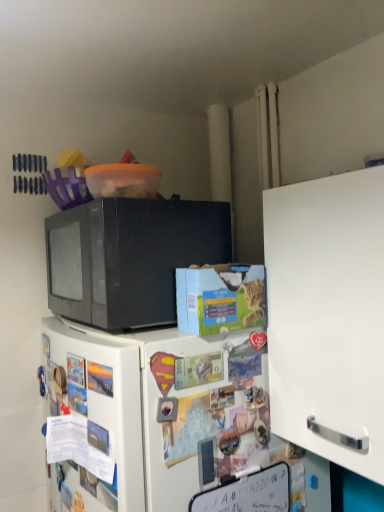
Describe the element at coordinates (130, 257) in the screenshot. The image size is (384, 512). I see `black matte microwave at upper left` at that location.

I want to click on white matte refrigerator at center, so click(x=164, y=422).

Locate an element on the screen. This screenshot has width=384, height=512. white matte cabinet at right is located at coordinates (328, 317).

In terms of width, does white matte refrigerator at center look wider or thinner when compared to black matte microwave at upper left?

In the image, white matte refrigerator at center appears to be wider than black matte microwave at upper left.

From the picture: Can you confirm if white matte refrigerator at center is smaller than black matte microwave at upper left?

No, white matte refrigerator at center is not smaller than black matte microwave at upper left.

Is white matte refrigerator at center surrounding black matte microwave at upper left?

No.

How far apart are white matte refrigerator at center and white matte cabinet at right?

The distance of white matte refrigerator at center from white matte cabinet at right is 10.03 inches.

Is point (153, 425) positioned after point (274, 207)?

No, (153, 425) is in front of (274, 207).

In the scene shown: Considering the relative positions of white matte refrigerator at center and white matte cabinet at right in the image provided, is white matte refrigerator at center to the right of white matte cabinet at right from the viewer's perspective?

No.

Based on their sizes in the image, would you say white matte refrigerator at center is bigger or smaller than white matte cabinet at right?

Considering their sizes, white matte refrigerator at center takes up more space than white matte cabinet at right.

Is white matte cabinet at right positioned with its back to white matte refrigerator at center?

No, white matte cabinet at right is not facing away from white matte refrigerator at center.

Measure the distance between white matte cabinet at right and white matte refrigerator at center.

white matte cabinet at right is 10.03 inches from white matte refrigerator at center.

Considering the relative sizes of white matte cabinet at right and white matte refrigerator at center in the image provided, is white matte cabinet at right bigger than white matte refrigerator at center?

No.

Is white matte cabinet at right inside the boundaries of white matte refrigerator at center, or outside?

white matte cabinet at right cannot be found inside white matte refrigerator at center.

From a real-world perspective, relative to white matte refrigerator at center, is black matte microwave at upper left vertically above or below?

In terms of real-world spatial position, black matte microwave at upper left is above white matte refrigerator at center.

Is white matte refrigerator at center a part of black matte microwave at upper left?

No, black matte microwave at upper left does not contain white matte refrigerator at center.

Are black matte microwave at upper left and white matte refrigerator at center located far from each other?

No.

Which of these two, black matte microwave at upper left or white matte cabinet at right, is wider?

Wider between the two is black matte microwave at upper left.

Is point (189, 207) in front of point (324, 404)?

No.

Is black matte microwave at upper left with white matte cabinet at right?

No, black matte microwave at upper left is not touching white matte cabinet at right.

Identify the location of microwave oven above the white matte cabinet at right (from the image's perspective). The height and width of the screenshot is (512, 384). click(130, 257).

What's the angular difference between white matte cabinet at right and black matte microwave at upper left's facing directions?

The facing directions of white matte cabinet at right and black matte microwave at upper left are 0.824 degrees apart.

Is point (307, 365) behind point (127, 291)?

No, it is in front of (127, 291).

Is white matte cabinet at right far from black matte microwave at upper left?

white matte cabinet at right is actually quite close to black matte microwave at upper left.

Could you tell me if white matte cabinet at right is facing black matte microwave at upper left?

No, white matte cabinet at right is not turned towards black matte microwave at upper left.

What are the coordinates of `microwave oven located above the white matte refrigerator at center (from a real-world perspective)` in the screenshot? It's located at (130, 257).

Identify the location of refrigerator lying below the white matte cabinet at right (from the image's perspective). (164, 422).

Looking at the image, which one is located further to white matte cabinet at right, black matte microwave at upper left or white matte refrigerator at center?

Among the two, black matte microwave at upper left is located further to white matte cabinet at right.

Estimate the real-world distances between objects in this image. Which object is further from black matte microwave at upper left, white matte cabinet at right or white matte refrigerator at center?

Among the two, white matte cabinet at right is located further to black matte microwave at upper left.

From the image, which object appears to be nearer to black matte microwave at upper left, white matte refrigerator at center or white matte cabinet at right?

Based on the image, white matte refrigerator at center appears to be nearer to black matte microwave at upper left.

Considering their positions, is white matte refrigerator at center positioned further to white matte cabinet at right than black matte microwave at upper left?

black matte microwave at upper left is positioned further to the anchor white matte cabinet at right.

From the image, which object appears to be nearer to white matte refrigerator at center, black matte microwave at upper left or white matte cabinet at right?

Based on the image, black matte microwave at upper left appears to be nearer to white matte refrigerator at center.

Considering their positions, is white matte cabinet at right positioned further to white matte refrigerator at center than black matte microwave at upper left?

The object further to white matte refrigerator at center is white matte cabinet at right.

Locate an element on the screen. The height and width of the screenshot is (512, 384). cabinetry that lies between black matte microwave at upper left and white matte refrigerator at center from top to bottom is located at coordinates (328, 317).